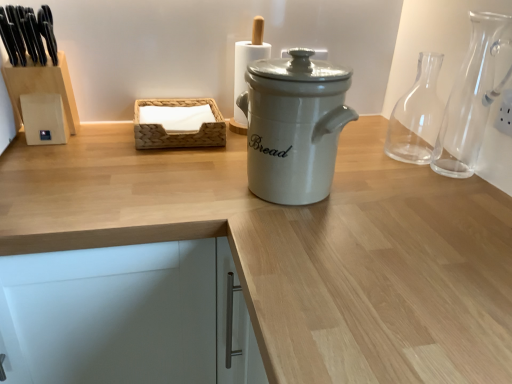
The width and height of the screenshot is (512, 384). I want to click on free space to the left of woven wood tissue box at center, so pos(101,132).